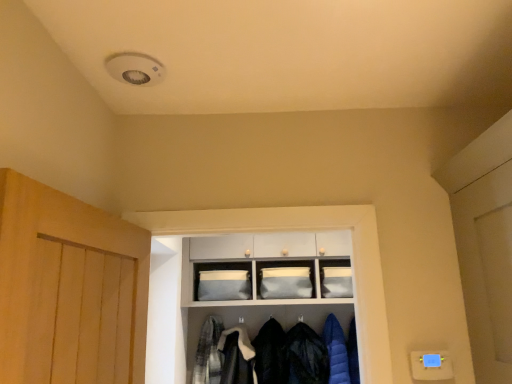
Question: From a real-world perspective, is plaid fabric shirt at center, which is counted as the 5th clothing, starting from the right, positioned over gray fabric storage at center, which ranks as the second shelf in top-to-bottom order, based on gravity?

Choices:
 (A) no
 (B) yes

Answer: (A)

Question: Is plaid fabric shirt at center, which is counted as the 5th clothing, starting from the right, smaller than gray fabric storage at center, which ranks as the second shelf in top-to-bottom order?

Choices:
 (A) yes
 (B) no

Answer: (A)

Question: Is plaid fabric shirt at center, which is counted as the 5th clothing, starting from the right, touching gray fabric storage at center, which ranks as the second shelf in top-to-bottom order?

Choices:
 (A) no
 (B) yes

Answer: (A)

Question: Is plaid fabric shirt at center, which is counted as the 5th clothing, starting from the right, wider than gray fabric storage at center, which ranks as the second shelf in top-to-bottom order?

Choices:
 (A) no
 (B) yes

Answer: (A)

Question: Considering the relative sizes of plaid fabric shirt at center, which is counted as the 5th clothing, starting from the right, and gray fabric storage at center, the 1th shelf when ordered from bottom to top, in the image provided, is plaid fabric shirt at center, which is counted as the 5th clothing, starting from the right, taller than gray fabric storage at center, the 1th shelf when ordered from bottom to top,?

Choices:
 (A) yes
 (B) no

Answer: (B)

Question: Do you think blue quilted jacket at lower right, positioned as the 1th clothing in right-to-left order, is within satin fabric cabinet at center, or outside of it?

Choices:
 (A) outside
 (B) inside

Answer: (A)

Question: From the image's perspective, is blue quilted jacket at lower right, the fifth clothing in the left-to-right sequence, located above or below satin fabric cabinet at center?

Choices:
 (A) below
 (B) above

Answer: (A)

Question: In the image, is blue quilted jacket at lower right, the fifth clothing in the left-to-right sequence, positioned in front of or behind satin fabric cabinet at center?

Choices:
 (A) behind
 (B) front

Answer: (B)

Question: Considering the relative positions of blue quilted jacket at lower right, the fifth clothing in the left-to-right sequence, and satin fabric cabinet at center in the image provided, is blue quilted jacket at lower right, the fifth clothing in the left-to-right sequence, to the left or to the right of satin fabric cabinet at center?

Choices:
 (A) left
 (B) right

Answer: (B)

Question: Is point (232, 380) positioned closer to the camera than point (280, 377)?

Choices:
 (A) farther
 (B) closer

Answer: (A)

Question: From the image's perspective, is white fluffy coat at lower center, which appears as the second clothing when viewed from the left, located above or below velvet black coat at center, which is counted as the third clothing, starting from the left?

Choices:
 (A) below
 (B) above

Answer: (B)

Question: Considering their positions, is white fluffy coat at lower center, which appears as the second clothing when viewed from the left, located in front of or behind velvet black coat at center, placed as the third clothing when sorted from right to left?

Choices:
 (A) behind
 (B) front

Answer: (B)

Question: Is white fluffy coat at lower center, which appears as the second clothing when viewed from the left, to the left or to the right of velvet black coat at center, placed as the third clothing when sorted from right to left, in the image?

Choices:
 (A) left
 (B) right

Answer: (A)

Question: Considering their positions, is dark blue quilted jacket at center, the 4th clothing positioned from the left, located in front of or behind plaid fabric shirt at center, which is counted as the 5th clothing, starting from the right?

Choices:
 (A) behind
 (B) front

Answer: (B)

Question: From the image's perspective, is dark blue quilted jacket at center, the 4th clothing positioned from the left, located above or below plaid fabric shirt at center, which is counted as the 5th clothing, starting from the right?

Choices:
 (A) below
 (B) above

Answer: (B)